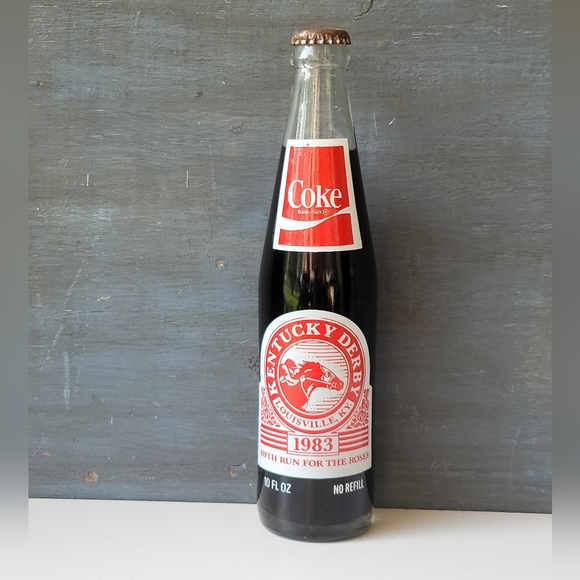
You are a GUI agent. You are given a task and a screenshot of the screen. Output one action in this format:
    pyautogui.click(x=<x>, y=<y>)
    Task: Click on the bottle
    The height and width of the screenshot is (580, 580).
    Given the screenshot: What is the action you would take?
    pyautogui.click(x=292, y=276)